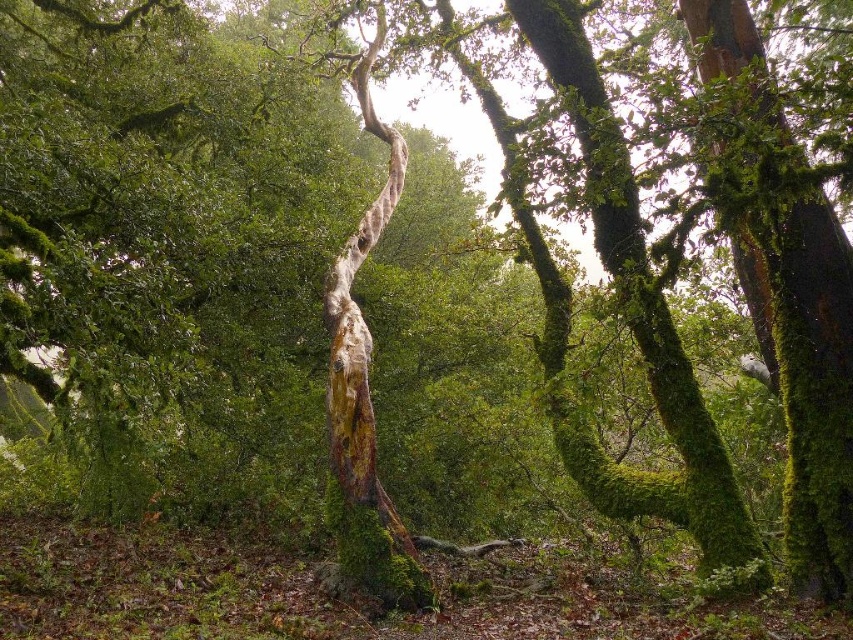
Question: From the image, what is the correct spatial relationship of green mossy tree trunk at right in relation to green mossy tree trunk at upper right?

Choices:
 (A) right
 (B) left

Answer: (A)

Question: Which point is closer to the camera taking this photo?

Choices:
 (A) (845, 556)
 (B) (622, 292)

Answer: (A)

Question: Which of the following is the closest to the observer?

Choices:
 (A) green mossy tree trunk at upper right
 (B) green mossy tree trunk at right

Answer: (B)

Question: In this image, where is green mossy tree trunk at right located relative to green mossy tree trunk at upper right?

Choices:
 (A) below
 (B) above

Answer: (A)

Question: Does green mossy tree trunk at right lie behind green mossy tree trunk at upper right?

Choices:
 (A) no
 (B) yes

Answer: (A)

Question: Which point is farther from the camera taking this photo?

Choices:
 (A) (704, 509)
 (B) (784, 125)

Answer: (A)